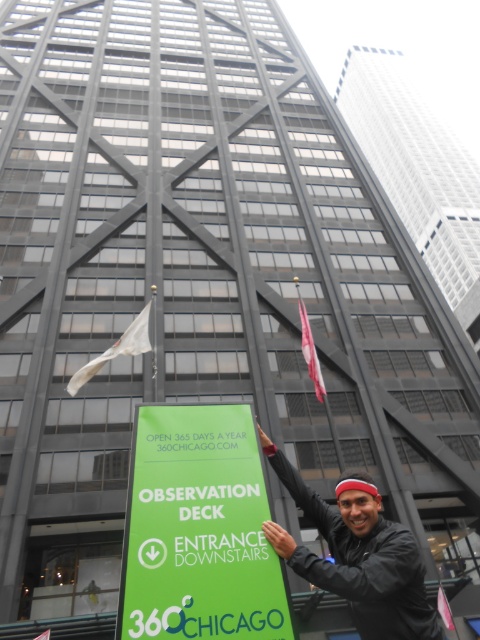
Question: Can you confirm if black leather jacket at lower right is positioned to the left of white fabric flag at center?

Choices:
 (A) yes
 (B) no

Answer: (B)

Question: Which point is farther from the camera taking this photo?

Choices:
 (A) (304, 340)
 (B) (288, 552)
 (C) (252, 440)
 (D) (132, 326)

Answer: (A)

Question: Considering the relative positions of white fabric flag at center and red fabric flag at center in the image provided, where is white fabric flag at center located with respect to red fabric flag at center?

Choices:
 (A) below
 (B) above

Answer: (A)

Question: Which object is positioned farthest from the white fabric flag at center?

Choices:
 (A) red fabric flag at center
 (B) black leather jacket at lower right
 (C) green matte sign at center

Answer: (A)

Question: Does green matte sign at center have a lesser width compared to white fabric flag at center?

Choices:
 (A) no
 (B) yes

Answer: (B)

Question: Which object appears farthest from the camera in this image?

Choices:
 (A) red fabric flag at center
 (B) white fabric flag at center
 (C) black leather jacket at lower right

Answer: (A)